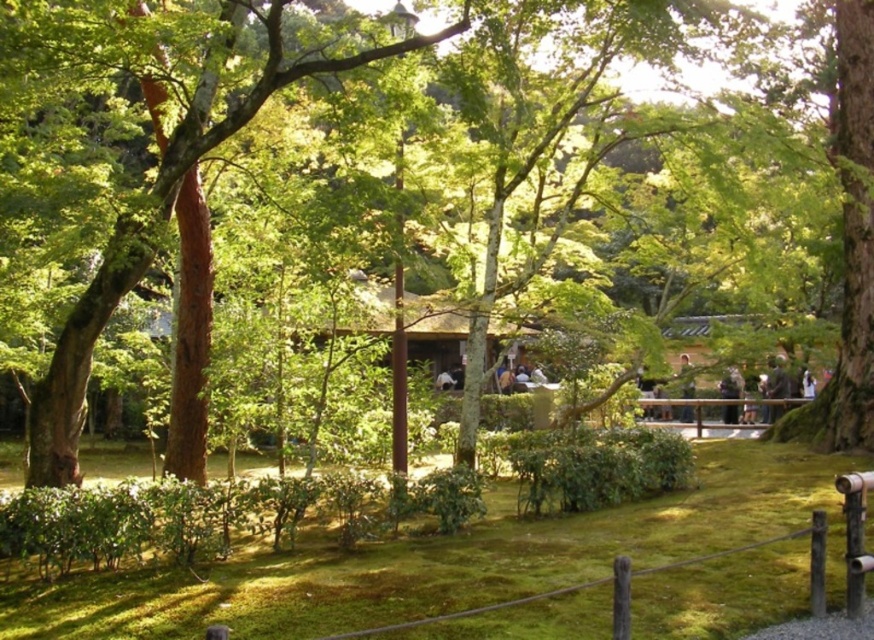
You are a visitor in the garden and want to sit down. There is a green mossy grass at center and a dark brown wooden bench at center. Which one is lower to the ground and suitable for sitting?

The green mossy grass at center is located below the dark brown wooden bench at center, so it is lower to the ground and suitable for sitting.

You are a visitor in the garden and want to locate the dark brown leather jacket at right. According to the coordinates provided, where would you find it?

The dark brown leather jacket at right is located at coordinates point [775,378].

You are standing in the garden and want to take a photo of the point at coordinates point (766, 529). If your camera has a maximum focus range of 10 meters, will it be able to focus on that point?

The distance of point (766, 529) from camera is 9.84 meters, so yes, the camera can focus on that point since it is within the maximum focus range of 10 meters.